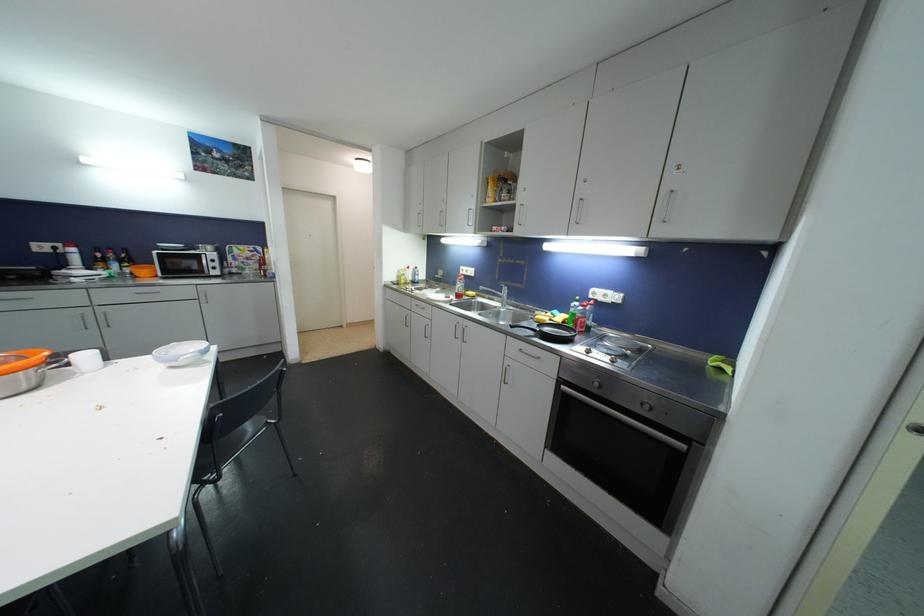
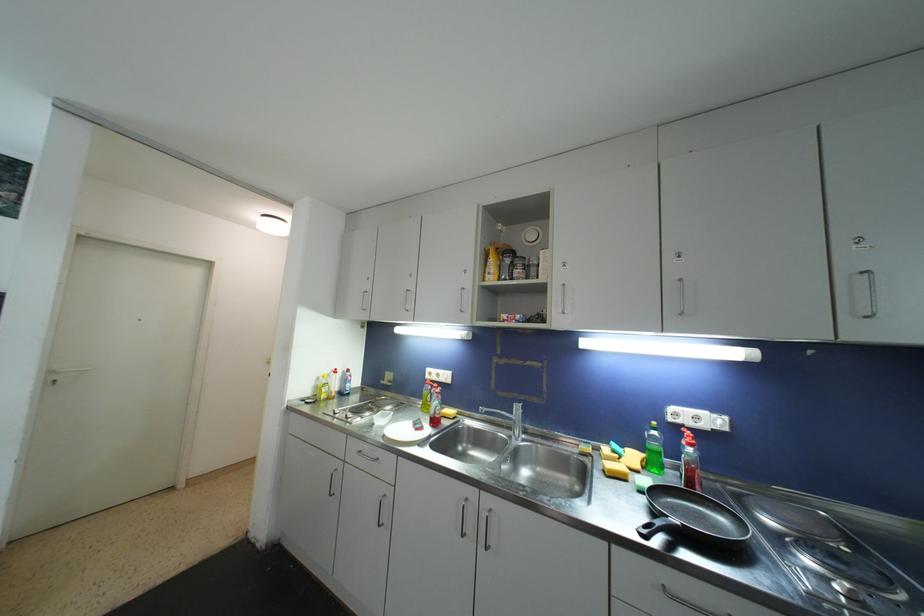
Based on the photo, how did the camera likely rotate?

The rotation direction of the camera is right-up.